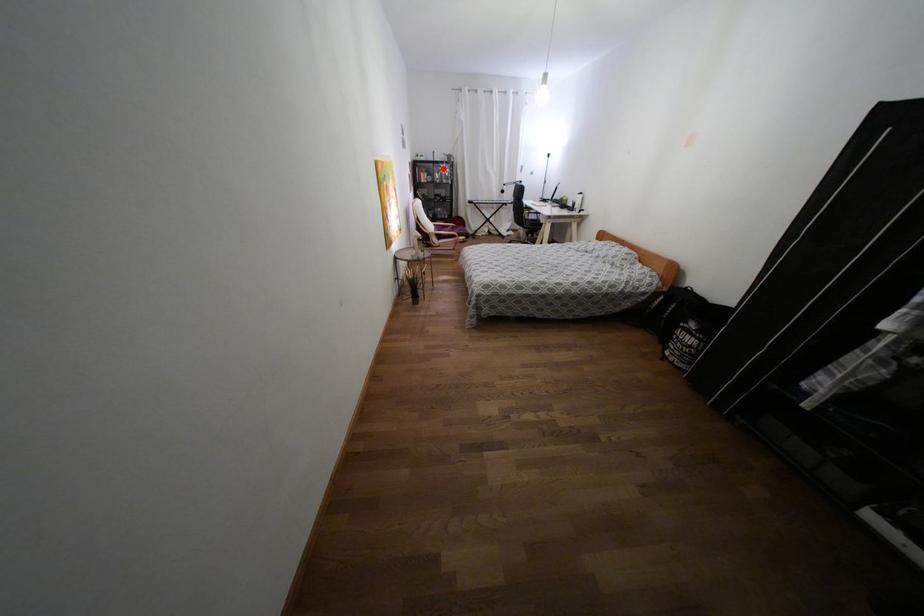
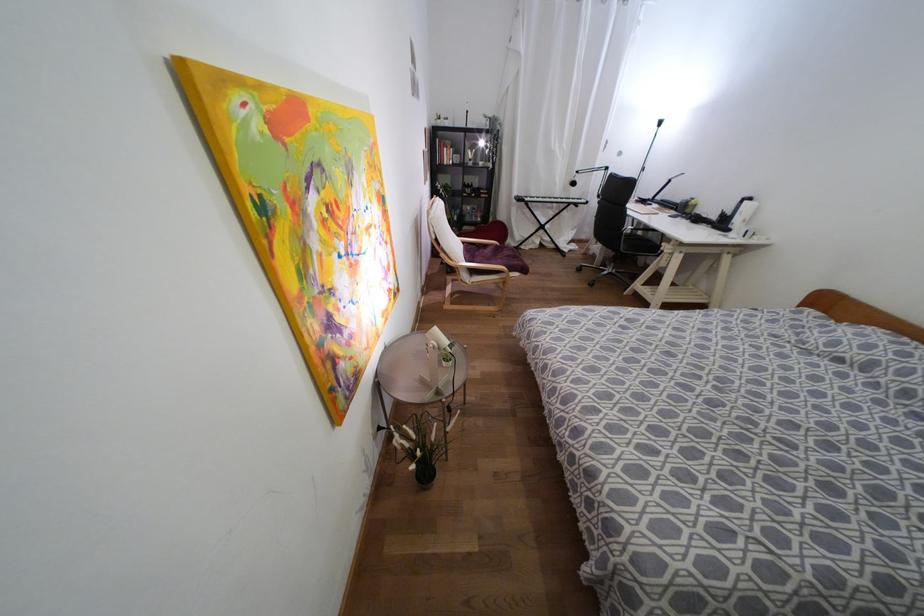
Where in the second image is the point corresponding to the highlighted location from the first image?

(480, 143)